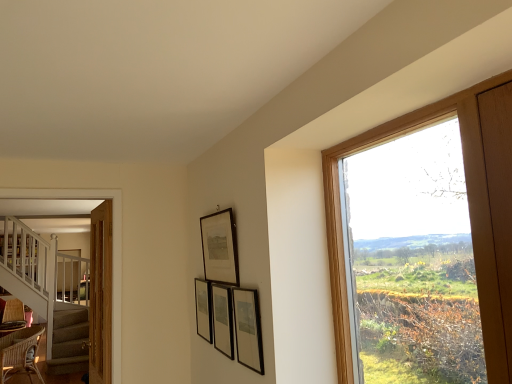
Question: In the image, is wooden frame at right on the left side or the right side of matte black picture frame at center, which is counted as the 4th picture frame, starting from the front?

Choices:
 (A) right
 (B) left

Answer: (A)

Question: From the image's perspective, is wooden frame at right above or below matte black picture frame at center, which is counted as the 1th picture frame, starting from the back?

Choices:
 (A) below
 (B) above

Answer: (B)

Question: Which object is positioned farthest from the matte black picture frame at center, the first picture frame when ordered from front to back?

Choices:
 (A) matte black picture frame at center, which is counted as the 4th picture frame, starting from the front
 (B) wooden door at left
 (C) wooden frame at right
 (D) matte black picture frame at center, acting as the second picture frame starting from the back
 (E) matte black picture frame at upper center, which is the 2th picture frame from front to back

Answer: (B)

Question: Which is farther from the wooden frame at right?

Choices:
 (A) matte black picture frame at center, which is counted as the 4th picture frame, starting from the front
 (B) matte black picture frame at center, acting as the second picture frame starting from the back
 (C) wicker chair at lower left
 (D) matte black picture frame at center, the first picture frame when ordered from front to back
 (E) woven brown armchair at lower left

Answer: (C)